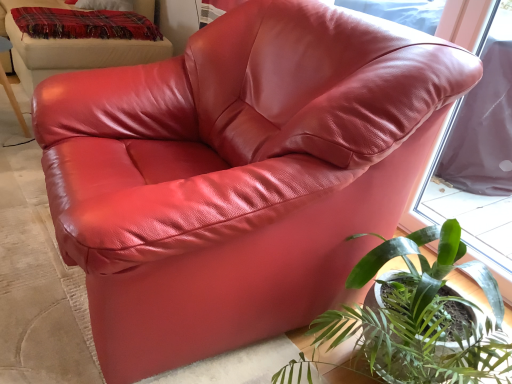
You are a GUI agent. You are given a task and a screenshot of the screen. Output one action in this format:
    pyautogui.click(x=<x>, y=<y>)
    Task: Click on the free space above plaid woolen blanket at upper left (from a real-world perspective)
    
    Given the screenshot: What is the action you would take?
    pyautogui.click(x=84, y=10)